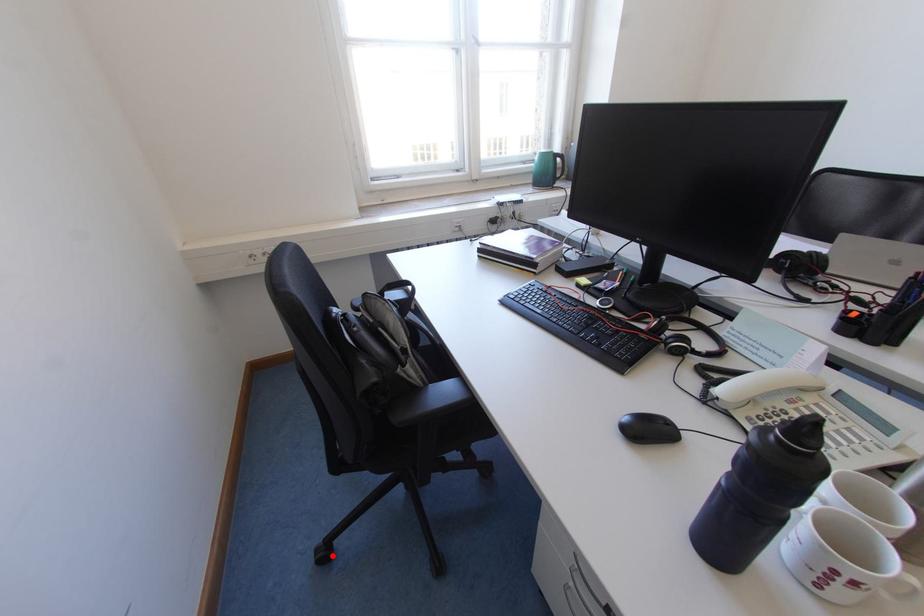
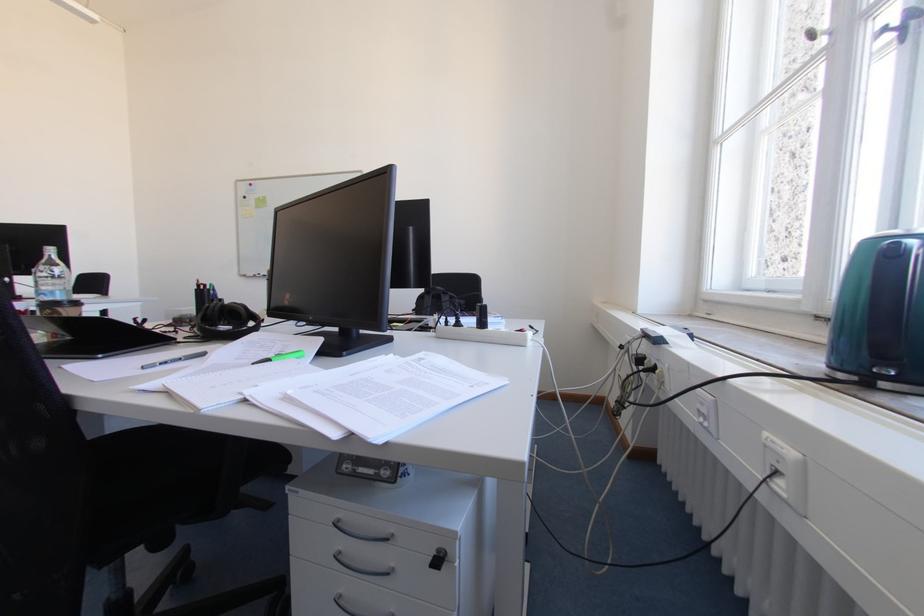
Question: I am providing you with two images of the same scene from different viewpoints. A red point is marked on the first image. Is the red point's position out of view in image 2?

Choices:
 (A) Yes
 (B) No

Answer: (A)